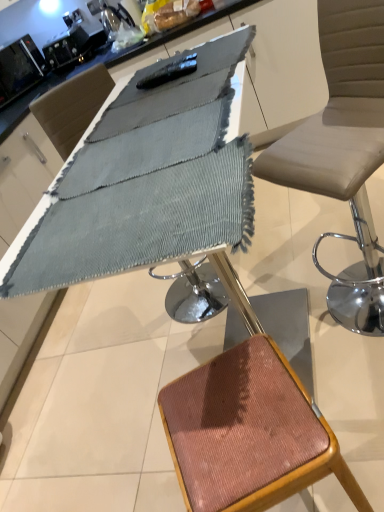
Measure the distance between textured gray fabric at center and camera.

textured gray fabric at center and camera are 62.79 centimeters apart.

At what (x,y) coordinates should I click in order to perform the action: click on rustic wood stool at lower right. Please return your answer as a coordinate pair (x, y). This screenshot has height=512, width=384. Looking at the image, I should click on (248, 433).

This screenshot has height=512, width=384. Identify the location of textured gray fabric at center. (139, 210).

How many degrees apart are the facing directions of textured gray fabric at center and black glossy microwave at upper left?

There is a 153-degree angle between the facing directions of textured gray fabric at center and black glossy microwave at upper left.

Which is closer, (148, 217) or (7, 71)?

Point (148, 217) appears to be closer to the viewer than point (7, 71).

Is textured gray fabric at center touching black glossy microwave at upper left?

They are not placed beside each other.

Can you tell me how much black glossy microwave at upper left and textured gray fabric at center differ in facing direction?

The facing directions of black glossy microwave at upper left and textured gray fabric at center are 153 degrees apart.

Are black glossy microwave at upper left and textured gray fabric at center far apart?

That's right, there is a large distance between black glossy microwave at upper left and textured gray fabric at center.

From the image's perspective, does black glossy microwave at upper left appear higher than textured gray fabric at center?

Yes.

The width and height of the screenshot is (384, 512). Find the location of `table that appears below the black glossy microwave at upper left (from the image's perspective)`. table that appears below the black glossy microwave at upper left (from the image's perspective) is located at coordinates (139, 210).

How many degrees apart are the facing directions of black glossy microwave at upper left and rustic wood stool at lower right?

black glossy microwave at upper left and rustic wood stool at lower right are facing 151 degrees away from each other.

Measure the distance between black glossy microwave at upper left and rustic wood stool at lower right.

8.52 feet.

Considering the sizes of objects black glossy microwave at upper left and rustic wood stool at lower right in the image provided, who is smaller, black glossy microwave at upper left or rustic wood stool at lower right?

With smaller size is black glossy microwave at upper left.

Which object is positioned more to the left, black glossy microwave at upper left or rustic wood stool at lower right?

Positioned to the left is black glossy microwave at upper left.

In terms of size, does textured gray fabric at center appear bigger or smaller than rustic wood stool at lower right?

Clearly, textured gray fabric at center is smaller in size than rustic wood stool at lower right.

Is textured gray fabric at center with rustic wood stool at lower right?

There is a gap between textured gray fabric at center and rustic wood stool at lower right.

Is textured gray fabric at center facing towards rustic wood stool at lower right?

No, textured gray fabric at center is not facing towards rustic wood stool at lower right.

Which is behind, rustic wood stool at lower right or textured gray fabric at center?

rustic wood stool at lower right is behind.

Do you think rustic wood stool at lower right is within textured gray fabric at center, or outside of it?

rustic wood stool at lower right is located beyond the bounds of textured gray fabric at center.

Is textured gray fabric at center at the back of rustic wood stool at lower right?

No, rustic wood stool at lower right's orientation is not away from textured gray fabric at center.

Which is behind, point (232, 423) or point (3, 100)?

The point (3, 100) is farther.

Which of these two, rustic wood stool at lower right or black glossy microwave at upper left, is bigger?

Bigger between the two is rustic wood stool at lower right.

Considering the relative positions of rustic wood stool at lower right and black glossy microwave at upper left in the image provided, is rustic wood stool at lower right to the left of black glossy microwave at upper left from the viewer's perspective?

Incorrect, rustic wood stool at lower right is not on the left side of black glossy microwave at upper left.

Find the location of a particular element. This screenshot has height=512, width=384. appliance behind the textured gray fabric at center is located at coordinates (19, 68).

The width and height of the screenshot is (384, 512). In order to click on appliance lying above the textured gray fabric at center (from the image's perspective) in this screenshot , I will do click(19, 68).

Based on their spatial positions, is black glossy microwave at upper left or textured gray fabric at center closer to rustic wood stool at lower right?

textured gray fabric at center is closer to rustic wood stool at lower right.

Considering their positions, is rustic wood stool at lower right positioned further to black glossy microwave at upper left than textured gray fabric at center?

Among the two, rustic wood stool at lower right is located further to black glossy microwave at upper left.

When comparing their distances from rustic wood stool at lower right, does textured gray fabric at center or black glossy microwave at upper left seem closer?

textured gray fabric at center.

Which object lies further to the anchor point textured gray fabric at center, rustic wood stool at lower right or black glossy microwave at upper left?

black glossy microwave at upper left lies further to textured gray fabric at center than the other object.

Based on their spatial positions, is textured gray fabric at center or rustic wood stool at lower right closer to black glossy microwave at upper left?

Among the two, textured gray fabric at center is located nearer to black glossy microwave at upper left.

When comparing their distances from textured gray fabric at center, does black glossy microwave at upper left or rustic wood stool at lower right seem closer?

rustic wood stool at lower right is positioned closer to the anchor textured gray fabric at center.

Find the location of a particular element. The width and height of the screenshot is (384, 512). stool between textured gray fabric at center and black glossy microwave at upper left from front to back is located at coordinates (248, 433).